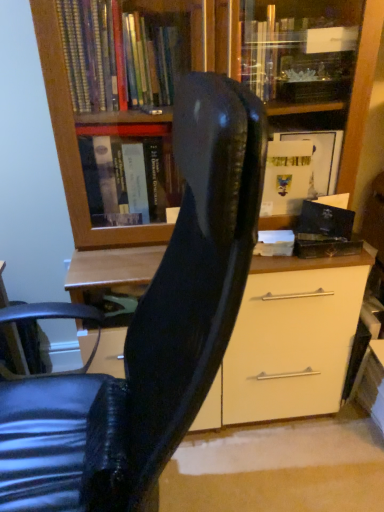
Describe the element at coordinates (151, 330) in the screenshot. I see `black leather chair at center` at that location.

This screenshot has height=512, width=384. Find the location of `black leather chair at center`. black leather chair at center is located at coordinates (151, 330).

Identify the location of black leather chair at center. (151, 330).